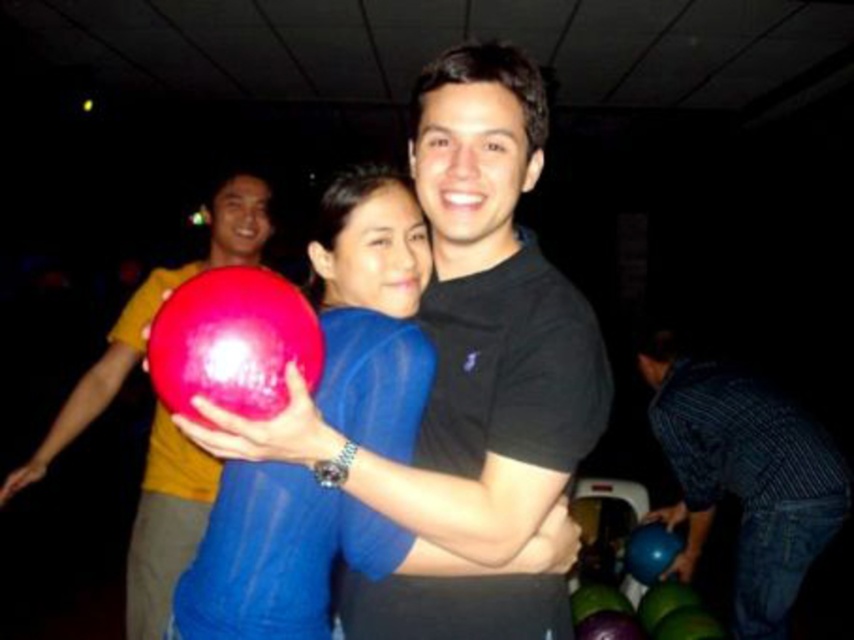
You are a bowler who needs to retrieve your rubberized yellow bowling ball at center and your rubberized red bowling ball at center before the next round starts in 2 minutes. The balls are currently 1.20 meters apart. Can you reach both balls within the time if you walk at a speed of 1 meter per second?

The rubberized yellow bowling ball at center is 1.20 meters from the rubberized red bowling ball at center. Since you walk at 1 meter per second, it would take 1.2 seconds to cover the distance between them. You can easily reach both balls within the 2 minutes available.

You are a bowling alley attendant and need to store the rubberized yellow bowling ball at center and the rubberized red bowling ball at center in a storage bin that can only accommodate items up to 12 inches in width. Based on the information provided, can both bowling balls fit into the bin?

The rubberized yellow bowling ball at center might be wider than the rubberized red bowling ball at center. Since the storage bin has a 12 inches width limit, if the yellow one is wider than 12 inches, it won would fit, but the red one might. However, without exact measurements, it is uncertain if both can fit.